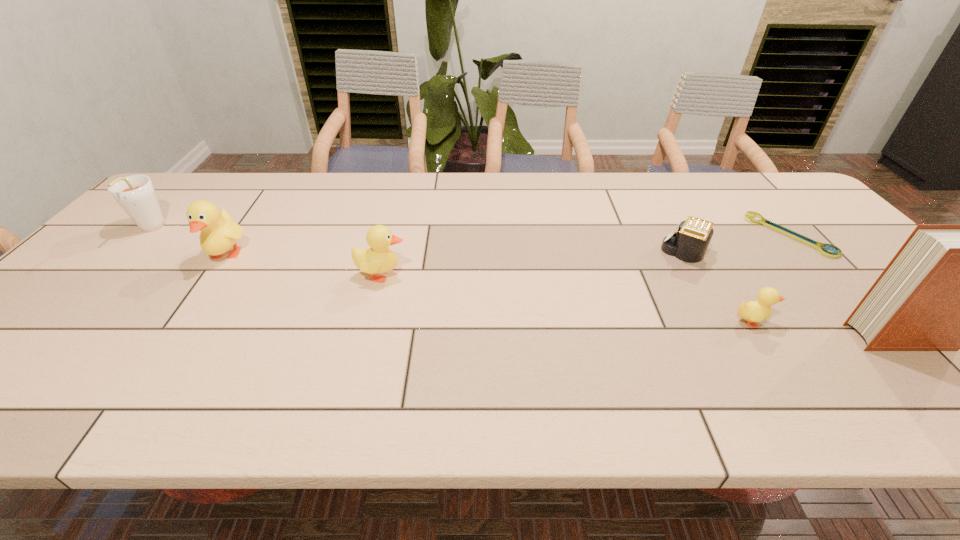
Select which duckling appears as the third closest to the shortest object. Please provide its 2D coordinates. Your answer should be formatted as a tuple, i.e. [(x, y)], where the tuple contains the x and y coordinates of a point satisfying the conditions above.

[(219, 232)]

Identify which duckling is the second closest to the nearest duckling. Please provide its 2D coordinates. Your answer should be formatted as a tuple, i.e. [(x, y)], where the tuple contains the x and y coordinates of a point satisfying the conditions above.

[(219, 232)]